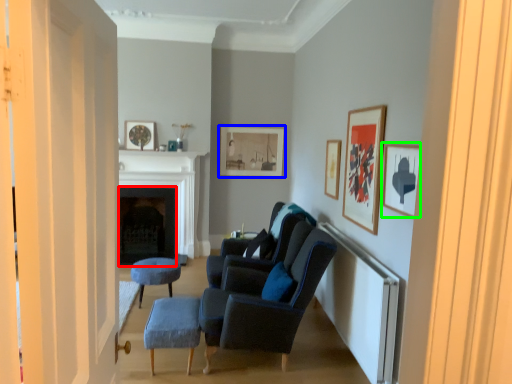
Question: Which object is the farthest from fireplace (highlighted by a red box)? Choose among these: picture frame (highlighted by a blue box) or picture frame (highlighted by a green box).

Choices:
 (A) picture frame
 (B) picture frame

Answer: (B)